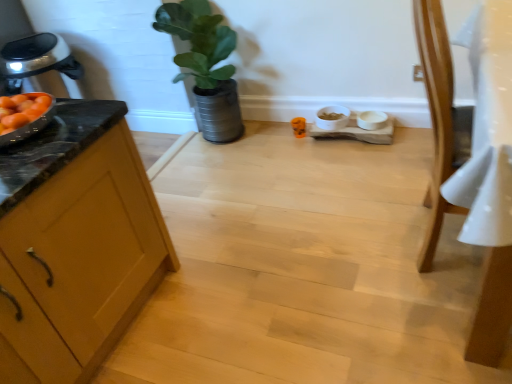
Where is `vacant space that is in between green matte plant at upper center and light brown wooden chair at right`? The image size is (512, 384). vacant space that is in between green matte plant at upper center and light brown wooden chair at right is located at coordinates (310, 176).